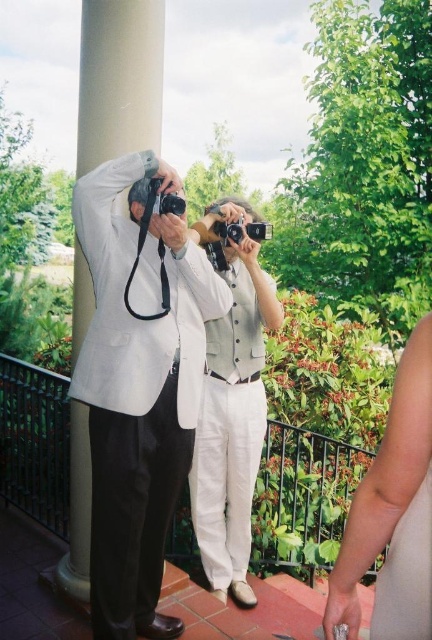
You are a photographer trying to set up a tripod between the matte white suit at left and the light gray vest at right. According to the coordinates provided, where should you place the tripod to ensure it is equidistant from both individuals?

The coordinates for the matte white suit at left are at point A, but the coordinates for the light gray vest at right are not provided. Without the coordinates of both individuals, it is impossible to determine the exact midpoint for the tripod placement.

You are a fashion designer observing the two items at the center of the balcony scene. Which item is bigger between the light gray cotton vest at center and the black plastic camera at center?

The light gray cotton vest at center is larger in size than the black plastic camera at center.

You are standing on the balcony and want to take a photo of the person at point (428, 595). However, there is an obstacle at point (231, 236). Will the obstacle block your view of the person?

Point (428, 595) is in front of point (231, 236), so the obstacle at point (231, 236) will not block your view of the person at point (428, 595).